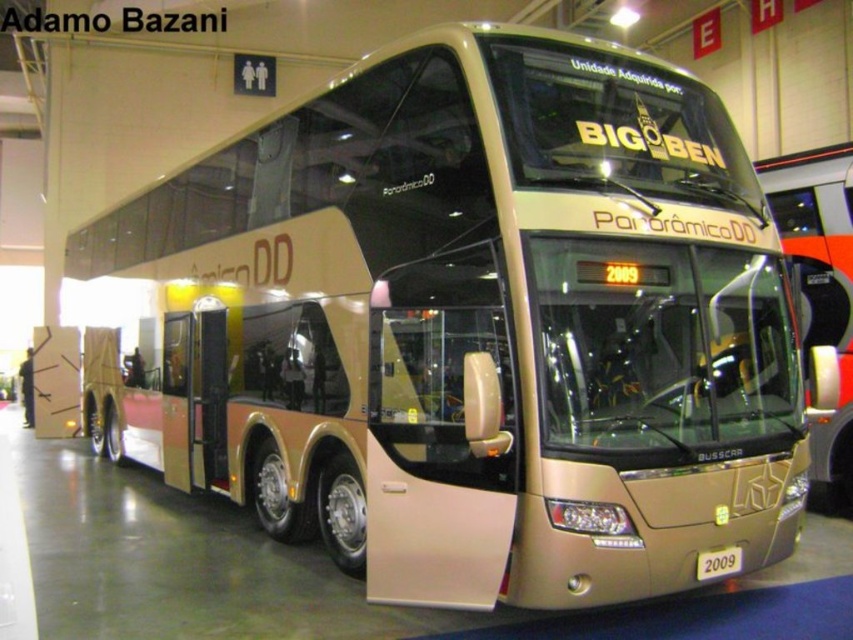
Question: Does gold metallic bus at center appear over gold metallic license plate at center?

Choices:
 (A) no
 (B) yes

Answer: (B)

Question: Which object is closer to the camera taking this photo?

Choices:
 (A) gold metallic license plate at center
 (B) gold metallic bus at center

Answer: (A)

Question: Does gold metallic bus at center appear on the right side of gold metallic license plate at center?

Choices:
 (A) yes
 (B) no

Answer: (A)

Question: Which object is farther from the camera taking this photo?

Choices:
 (A) gold metallic bus at center
 (B) gold metallic license plate at center

Answer: (A)

Question: Is gold metallic bus at center wider than gold metallic license plate at center?

Choices:
 (A) yes
 (B) no

Answer: (A)